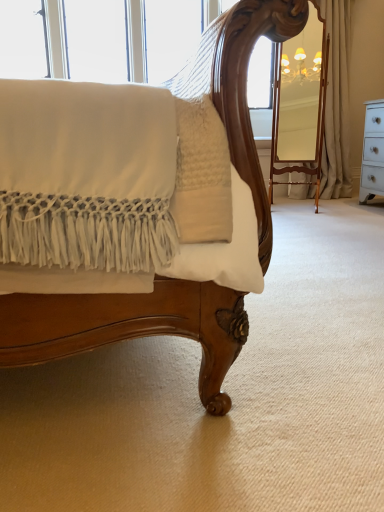
Question: From the image's perspective, is beige fabric curtain at right, the second curtain when ordered from left to right, located above or below beige fabric curtain at upper right, the 1th curtain positioned from the left?

Choices:
 (A) below
 (B) above

Answer: (B)

Question: From a real-world perspective, is beige fabric curtain at right, the second curtain when ordered from left to right, positioned above or below beige fabric curtain at upper right, the 1th curtain positioned from the left?

Choices:
 (A) below
 (B) above

Answer: (B)

Question: Visually, is beige fabric curtain at right, the second curtain when ordered from left to right, positioned to the left or to the right of beige fabric curtain at upper right, the second curtain when ordered from right to left?

Choices:
 (A) left
 (B) right

Answer: (B)

Question: Is beige fabric curtain at upper right, the second curtain when ordered from right to left, in front of or behind beige fabric curtain at right, marked as the first curtain in a right-to-left arrangement, in the image?

Choices:
 (A) behind
 (B) front

Answer: (B)

Question: Considering the positions of point (334, 186) and point (345, 166), is point (334, 186) closer or farther from the camera than point (345, 166)?

Choices:
 (A) closer
 (B) farther

Answer: (A)

Question: Considering the positions of beige fabric curtain at upper right, the second curtain when ordered from right to left, and beige fabric curtain at right, marked as the first curtain in a right-to-left arrangement, in the image, is beige fabric curtain at upper right, the second curtain when ordered from right to left, bigger or smaller than beige fabric curtain at right, marked as the first curtain in a right-to-left arrangement,?

Choices:
 (A) big
 (B) small

Answer: (A)

Question: Looking at their shapes, would you say beige fabric curtain at upper right, the second curtain when ordered from right to left, is wider or thinner than beige fabric curtain at right, marked as the first curtain in a right-to-left arrangement?

Choices:
 (A) wide
 (B) thin

Answer: (A)